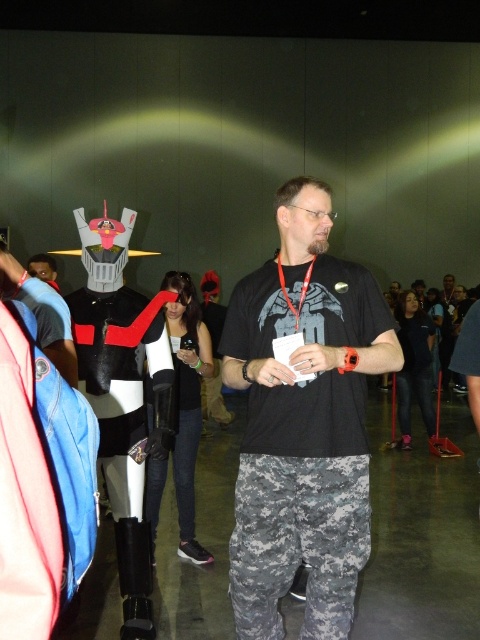
You are standing in the center of the hall and want to find the digital camo pants at center. According to the coordinates provided, in which direction should you move to locate them?

The digital camo pants at center is located at coordinates point (298, 541). Since you are at the center, which is typically considered as point (240, 320), you should move towards the lower right direction to reach them.